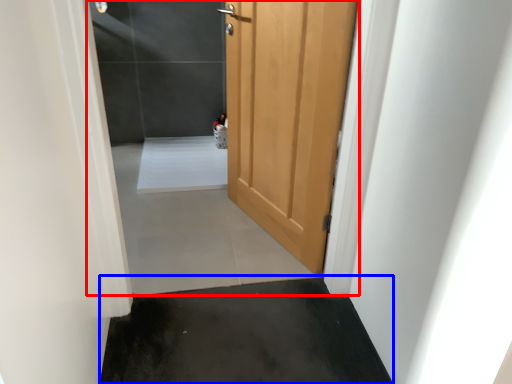
Question: Which point is closer to the camera, screen door (highlighted by a red box) or concrete (highlighted by a blue box)?

Choices:
 (A) screen door
 (B) concrete

Answer: (A)